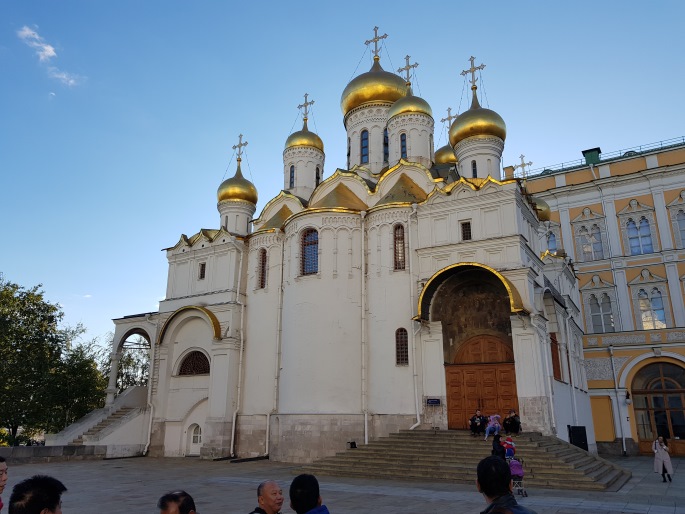
Identify the location of door. The height and width of the screenshot is (514, 685). (488, 399), (175, 458).